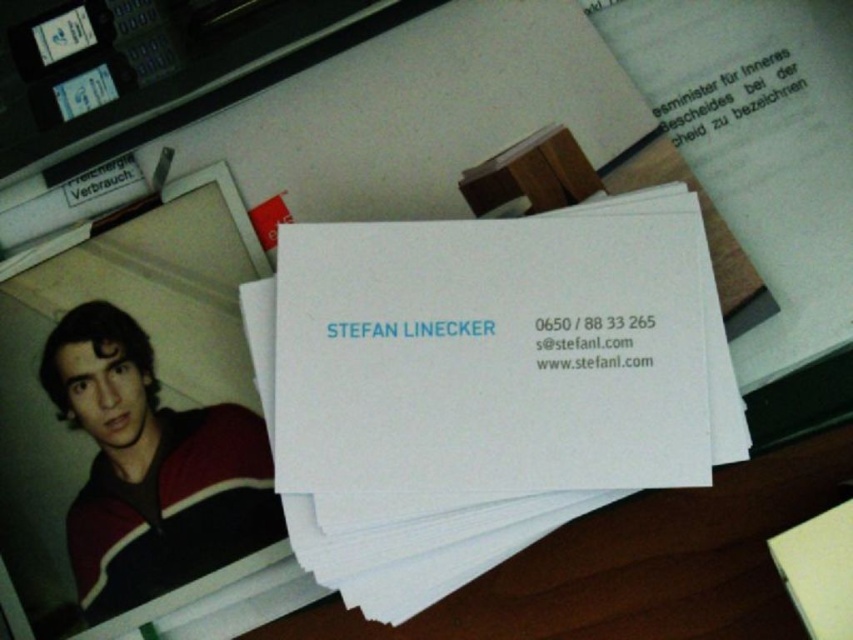
You are organizing a desk and need to place the white paper at center and the striped sweater at lower left. Which object should you move first if you want to place them side by side without overlapping?

The striped sweater at lower left should be moved first because the white paper at center might be wider than striped sweater at lower left, so moving the smaller object first allows proper alignment.

You are organizing a desk and see the white paper at center and the white matte business card at center. Which one is positioned to the right side?

The white paper at center is positioned to the right of the white matte business card at center.